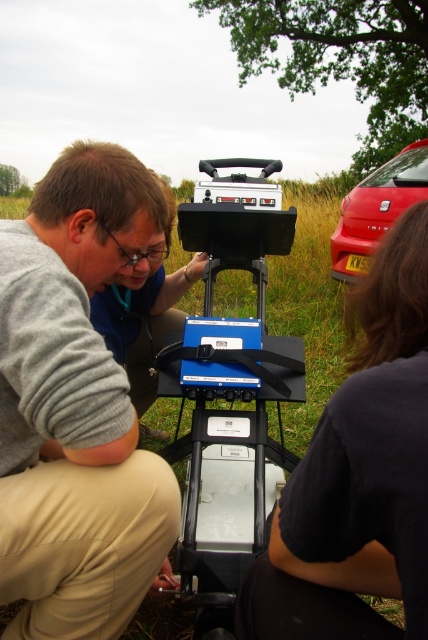
Which is more to the right, dark gray fabric at lower right or metallic red car at right?

From the viewer's perspective, metallic red car at right appears more on the right side.

Does point (371, 268) come behind point (356, 230)?

No.

Between point (386, 442) and point (353, 260), which one is positioned in front?

Point (386, 442) is in front.

The height and width of the screenshot is (640, 428). Find the location of `dark gray fabric at lower right`. dark gray fabric at lower right is located at coordinates (359, 474).

Does gray fabric shirt at center come behind metallic red car at right?

No, gray fabric shirt at center is closer to the viewer.

Can you confirm if gray fabric shirt at center is positioned to the left of metallic red car at right?

Yes, gray fabric shirt at center is to the left of metallic red car at right.

Between point (38, 214) and point (419, 180), which one is positioned behind?

Positioned behind is point (419, 180).

You are a GUI agent. You are given a task and a screenshot of the screen. Output one action in this format:
    pyautogui.click(x=<x>, y=<y>)
    Task: Click on the gray fabric shirt at center
    
    Given the screenshot: What is the action you would take?
    pyautogui.click(x=76, y=406)

Between gray fabric shirt at center and dark gray fabric at lower right, which one is positioned higher?

gray fabric shirt at center is above.

Is gray fabric shirt at center smaller than dark gray fabric at lower right?

Actually, gray fabric shirt at center might be larger than dark gray fabric at lower right.

Between point (89, 467) and point (350, 627), which one is positioned in front?

Point (350, 627)

This screenshot has width=428, height=640. In order to click on gray fabric shirt at center in this screenshot , I will do `click(76, 406)`.